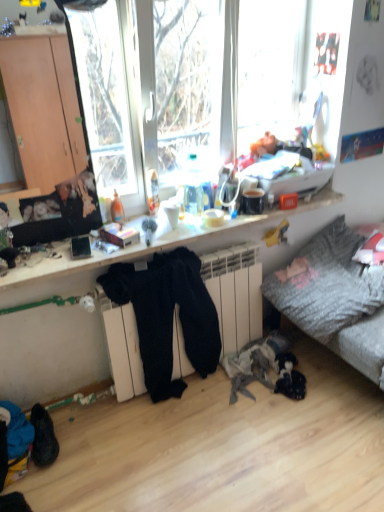
Question: From the image's perspective, is textured gray fabric couch at lower right above black suede shoes at lower left?

Choices:
 (A) no
 (B) yes

Answer: (B)

Question: Does textured gray fabric couch at lower right have a greater height compared to black suede shoes at lower left?

Choices:
 (A) yes
 (B) no

Answer: (A)

Question: Can you confirm if textured gray fabric couch at lower right is smaller than black suede shoes at lower left?

Choices:
 (A) no
 (B) yes

Answer: (A)

Question: Considering the relative positions of textured gray fabric couch at lower right and black suede shoes at lower left in the image provided, is textured gray fabric couch at lower right to the left of black suede shoes at lower left from the viewer's perspective?

Choices:
 (A) no
 (B) yes

Answer: (A)

Question: Does textured gray fabric couch at lower right have a larger size compared to black suede shoes at lower left?

Choices:
 (A) yes
 (B) no

Answer: (A)

Question: Looking at the image, does black fuzzy pants at center seem bigger or smaller compared to black suede shoes at lower left?

Choices:
 (A) big
 (B) small

Answer: (A)

Question: From the image's perspective, is black fuzzy pants at center positioned above or below black suede shoes at lower left?

Choices:
 (A) below
 (B) above

Answer: (B)

Question: Considering the positions of black fuzzy pants at center and black suede shoes at lower left in the image, is black fuzzy pants at center wider or thinner than black suede shoes at lower left?

Choices:
 (A) thin
 (B) wide

Answer: (A)

Question: Do you think black fuzzy pants at center is within black suede shoes at lower left, or outside of it?

Choices:
 (A) outside
 (B) inside

Answer: (A)

Question: Is wooden desk at center in front of or behind black suede shoes at lower left in the image?

Choices:
 (A) behind
 (B) front

Answer: (B)

Question: Based on their positions, is wooden desk at center located to the left or right of black suede shoes at lower left?

Choices:
 (A) right
 (B) left

Answer: (A)

Question: Is wooden desk at center wider or thinner than black suede shoes at lower left?

Choices:
 (A) wide
 (B) thin

Answer: (A)

Question: Considering the positions of wooden desk at center and black suede shoes at lower left in the image, is wooden desk at center taller or shorter than black suede shoes at lower left?

Choices:
 (A) short
 (B) tall

Answer: (A)

Question: Is textured gray fabric couch at lower right taller or shorter than black suede shoes at lower left?

Choices:
 (A) short
 (B) tall

Answer: (B)

Question: Would you say textured gray fabric couch at lower right is inside or outside black suede shoes at lower left?

Choices:
 (A) outside
 (B) inside

Answer: (A)